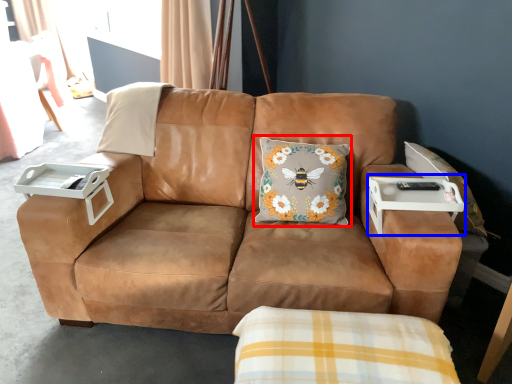
Question: Which point is closer to the camera, throw pillow (highlighted by a red box) or table (highlighted by a blue box)?

Choices:
 (A) throw pillow
 (B) table

Answer: (B)